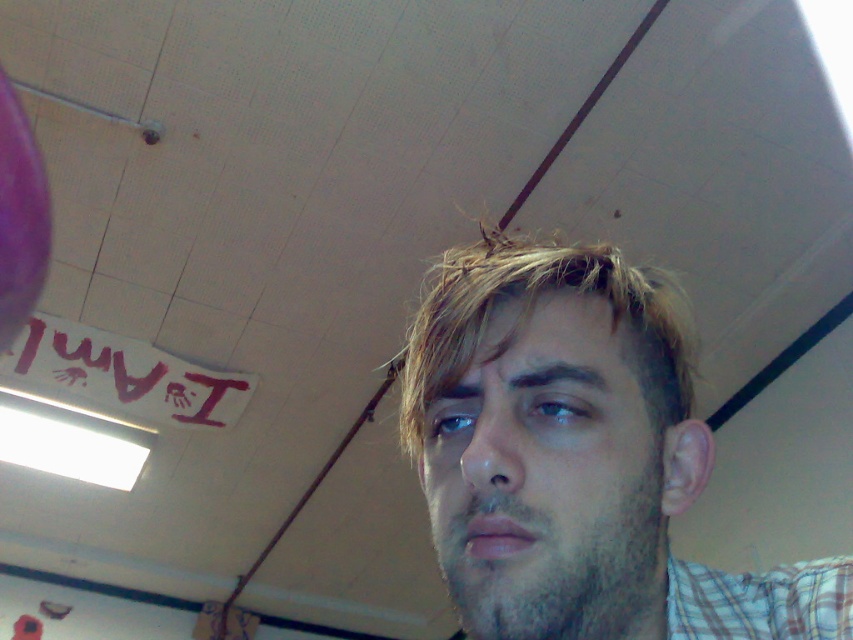
You are an artist trying to sketch the scene. You need to decide which object to draw first based on their size. According to the scene, which object is narrower between the light brown hair at center and the handprint graffiti at upper left?

The light brown hair at center has a lesser width compared to the handprint graffiti at upper left, so you should draw the light brown hair at center first since it is narrower.

You are a passenger in a train and see a person with light brown hair at center and handprint graffiti at upper left. Which object is closer to you?

The light brown hair at center is closer to you because it is above the handprint graffiti at upper left, indicating it is in front of it.